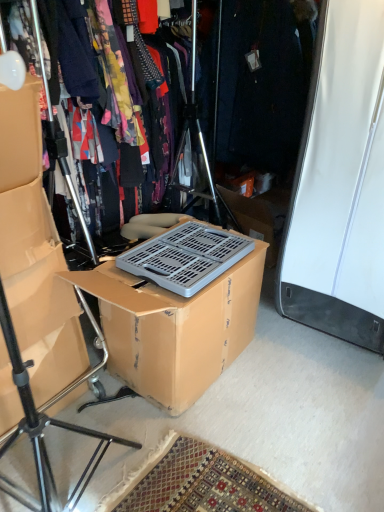
In order to face matte black tripod at left, should I rotate leftwards or rightwards?

To align with it, rotate left about 26.490°.

The image size is (384, 512). What do you see at coordinates (69, 48) in the screenshot?
I see `floral fabric dress at center` at bounding box center [69, 48].

Image resolution: width=384 pixels, height=512 pixels. In order to click on matte black tripod at left in this screenshot , I will do `click(44, 426)`.

Is matte cardboard box at left behind matte black tripod at left?

Yes, it is.

At what (x,y) coordinates should I click in order to perform the action: click on tripod in front of the matte cardboard box at left. Please return your answer as a coordinate pair (x, y). The height and width of the screenshot is (512, 384). Looking at the image, I should click on (44, 426).

From the image's perspective, would you say matte cardboard box at left is shown under matte black tripod at left?

No, from the image's perspective, matte cardboard box at left is not beneath matte black tripod at left.

How different are the orientations of matte cardboard box at left and matte black tripod at left in degrees?

matte cardboard box at left and matte black tripod at left are facing 0.225 degrees away from each other.

Is brown cardboard box at center completely or partially inside matte cardboard box at left?

No.

Between matte cardboard box at left and brown cardboard box at center, which one has smaller size?

matte cardboard box at left.

From the picture: Is matte cardboard box at left in front of or behind brown cardboard box at center in the image?

In the image, matte cardboard box at left appears in front of brown cardboard box at center.

Between matte cardboard box at left and brown cardboard box at center, which one has more height?

Standing taller between the two is matte cardboard box at left.

From the image's perspective, does matte black tripod at left appear lower than matte cardboard box at left?

Yes, from the image's perspective, matte black tripod at left is below matte cardboard box at left.

Does matte black tripod at left have a larger size compared to matte cardboard box at left?

Correct, matte black tripod at left is larger in size than matte cardboard box at left.

Is matte black tripod at left situated inside matte cardboard box at left or outside?

matte black tripod at left exists outside the volume of matte cardboard box at left.

From a real-world perspective, is matte black tripod at left physically located above or below matte cardboard box at left?

matte black tripod at left is situated lower than matte cardboard box at left in the real world.

From their relative heights in the image, would you say matte black tripod at left is taller or shorter than floral fabric dress at center?

Considering their sizes, matte black tripod at left has more height than floral fabric dress at center.

Find the location of a particular element. The width and height of the screenshot is (384, 512). clothing that is behind the matte black tripod at left is located at coordinates (69, 48).

Consider the image. Relative to floral fabric dress at center, is matte black tripod at left in front or behind?

matte black tripod at left is in front of floral fabric dress at center.

Is floral fabric dress at center shorter than matte black tripod at left?

Indeed, floral fabric dress at center has a lesser height compared to matte black tripod at left.

Considering the sizes of floral fabric dress at center and matte black tripod at left in the image, is floral fabric dress at center bigger or smaller than matte black tripod at left?

Clearly, floral fabric dress at center is smaller in size than matte black tripod at left.

Which object is more forward, floral fabric dress at center or matte black tripod at left?

matte black tripod at left.

Is floral fabric dress at center beside matte black tripod at left?

No, floral fabric dress at center is not next to matte black tripod at left.

In the image, is floral fabric dress at center on the left side or the right side of brown cardboard box at center?

floral fabric dress at center is to the left of brown cardboard box at center.

Where is `box below the floral fabric dress at center (from a real-world perspective)`? The width and height of the screenshot is (384, 512). box below the floral fabric dress at center (from a real-world perspective) is located at coordinates (177, 309).

Does floral fabric dress at center lie in front of brown cardboard box at center?

That is False.

Considering the sizes of objects floral fabric dress at center and matte cardboard box at left in the image provided, who is wider, floral fabric dress at center or matte cardboard box at left?

With larger width is floral fabric dress at center.

Is floral fabric dress at center far from matte cardboard box at left?

That's not correct — floral fabric dress at center is a little close to matte cardboard box at left.

From the image's perspective, is floral fabric dress at center beneath matte cardboard box at left?

Incorrect, from the image's perspective, floral fabric dress at center is higher than matte cardboard box at left.

Is floral fabric dress at center positioned beyond the bounds of matte cardboard box at left?

Yes, floral fabric dress at center is located beyond the bounds of matte cardboard box at left.

Where is `storage box positioned vertically above the matte black tripod at left (from a real-world perspective)`? The height and width of the screenshot is (512, 384). storage box positioned vertically above the matte black tripod at left (from a real-world perspective) is located at coordinates (39, 291).

At what (x,y) coordinates should I click in order to perform the action: click on box on the right side of matte cardboard box at left. Please return your answer as a coordinate pair (x, y). The height and width of the screenshot is (512, 384). Looking at the image, I should click on (177, 309).

Which object lies further to the anchor point floral fabric dress at center, brown cardboard box at center or matte black tripod at left?

The object further to floral fabric dress at center is matte black tripod at left.

Estimate the real-world distances between objects in this image. Which object is further from floral fabric dress at center, matte cardboard box at left or brown cardboard box at center?

brown cardboard box at center is positioned further to the anchor floral fabric dress at center.

Which object lies nearer to the anchor point brown cardboard box at center, matte cardboard box at left or matte black tripod at left?

matte cardboard box at left is positioned closer to the anchor brown cardboard box at center.

Estimate the real-world distances between objects in this image. Which object is closer to floral fabric dress at center, matte black tripod at left or matte cardboard box at left?

matte cardboard box at left is closer to floral fabric dress at center.

Looking at the image, which one is located further to matte cardboard box at left, matte black tripod at left or brown cardboard box at center?

The object further to matte cardboard box at left is brown cardboard box at center.

In the scene shown: Considering their positions, is brown cardboard box at center positioned further to matte cardboard box at left than floral fabric dress at center?

floral fabric dress at center lies further to matte cardboard box at left than the other object.

Estimate the real-world distances between objects in this image. Which object is closer to matte cardboard box at left, floral fabric dress at center or brown cardboard box at center?

Among the two, brown cardboard box at center is located nearer to matte cardboard box at left.

Which object lies further to the anchor point brown cardboard box at center, matte cardboard box at left or floral fabric dress at center?

floral fabric dress at center.

Where is `storage box between floral fabric dress at center and matte black tripod at left vertically`? storage box between floral fabric dress at center and matte black tripod at left vertically is located at coordinates coord(39,291).

Find the location of a particular element. tripod between floral fabric dress at center and brown cardboard box at center in the up-down direction is located at coordinates (44, 426).

Image resolution: width=384 pixels, height=512 pixels. I want to click on storage box between floral fabric dress at center and brown cardboard box at center from top to bottom, so click(39, 291).

Locate an element on the screen. This screenshot has width=384, height=512. storage box situated between matte black tripod at left and brown cardboard box at center from left to right is located at coordinates (39, 291).